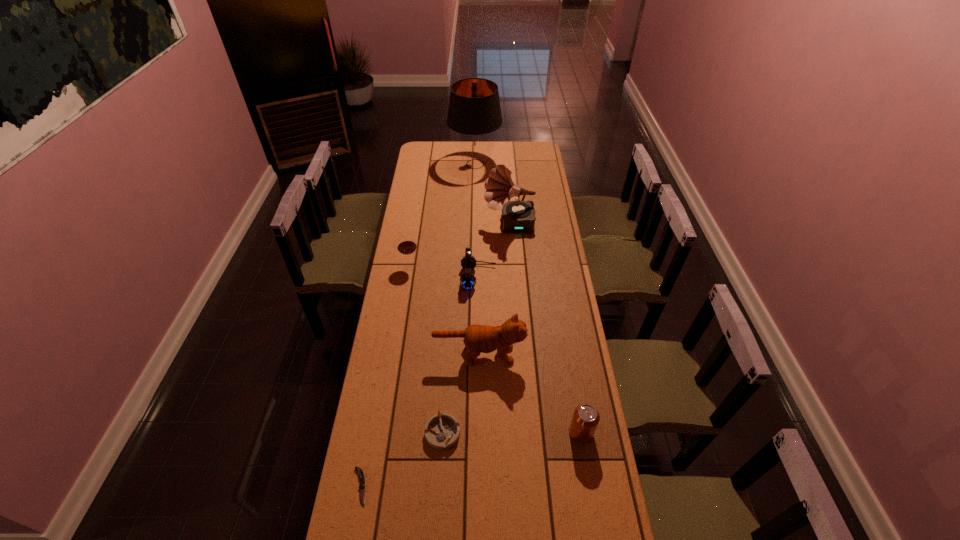
Where is `vacant region located on the right of the seventh tallest object`? This screenshot has width=960, height=540. vacant region located on the right of the seventh tallest object is located at coordinates (563, 432).

I want to click on free space located on the back of the shortest object, so click(373, 413).

Find the location of a particular element. object present at the far edge is located at coordinates (474, 114).

The width and height of the screenshot is (960, 540). What are the coordinates of `wineglass positioned at the left edge` in the screenshot? It's located at (406, 245).

Image resolution: width=960 pixels, height=540 pixels. I want to click on pocketknife that is at the left edge, so click(x=361, y=475).

Image resolution: width=960 pixels, height=540 pixels. What are the coordinates of `record player present at the right edge` in the screenshot? It's located at (518, 217).

I want to click on can that is positioned at the right edge, so click(x=585, y=419).

In the image, there is a desktop. Find the location of `vacant space at the far edge`. vacant space at the far edge is located at coordinates (500, 145).

In the image, there is a desktop. What are the coordinates of `vacant space at the left edge` in the screenshot? It's located at (391, 532).

The height and width of the screenshot is (540, 960). In order to click on free region at the right edge of the desktop in this screenshot , I will do `click(540, 328)`.